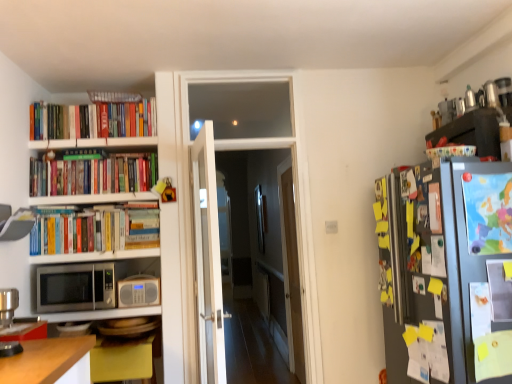
Locate an element on the screen. free point above clear glass door at center, arranged as the first glass door when viewed from the left (from a real-world perspective) is located at coordinates (243, 66).